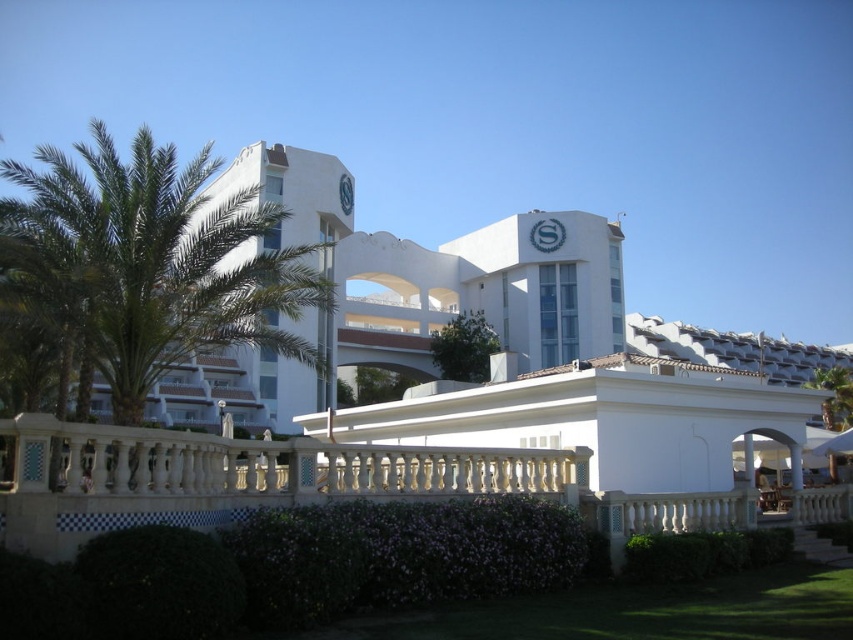
Question: Among these objects, which one is nearest to the camera?

Choices:
 (A) purple leafy hedge at center
 (B) green leafy palm tree at left
 (C) green leafy hedge at lower center

Answer: (A)

Question: Which object appears farthest from the camera in this image?

Choices:
 (A) green leafy hedge at lower center
 (B) green leafy palm tree at left
 (C) purple leafy hedge at center

Answer: (A)

Question: Is green leafy palm tree at left wider than green leafy hedge at lower center?

Choices:
 (A) yes
 (B) no

Answer: (A)

Question: Does green leafy palm tree at left appear over purple leafy hedge at center?

Choices:
 (A) yes
 (B) no

Answer: (A)

Question: Which object is positioned closest to the green leafy hedge at lower center?

Choices:
 (A) purple leafy hedge at center
 (B) green leafy palm tree at left

Answer: (A)

Question: Is green leafy palm tree at left to the right of purple leafy hedge at center from the viewer's perspective?

Choices:
 (A) no
 (B) yes

Answer: (A)